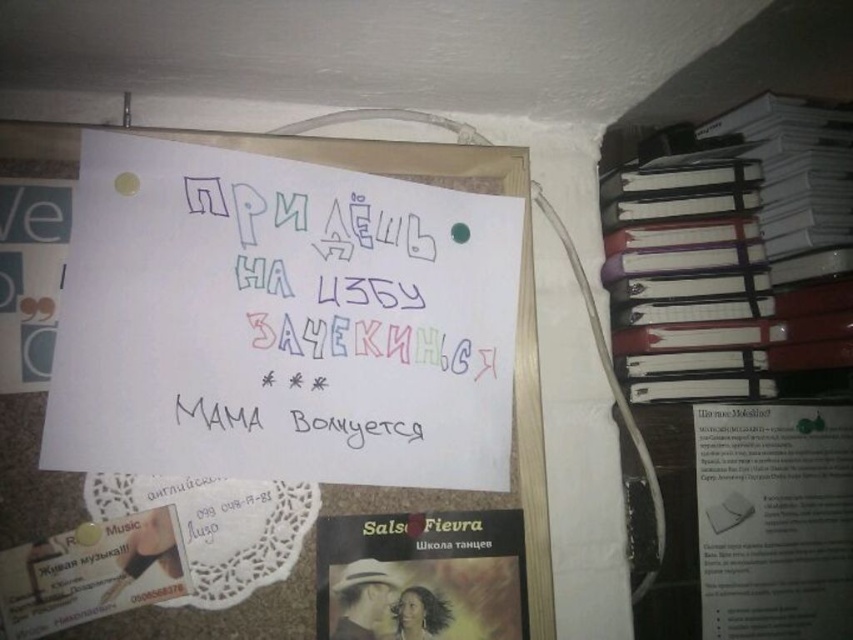
Question: Does white paper at right come in front of white paper at upper center?

Choices:
 (A) no
 (B) yes

Answer: (A)

Question: Is colored paper note at center to the right of white paper at right from the viewer's perspective?

Choices:
 (A) no
 (B) yes

Answer: (A)

Question: Does colored paper note at center appear on the right side of white paper at right?

Choices:
 (A) no
 (B) yes

Answer: (A)

Question: Based on their relative distances, which object is nearer to the matte black book at center?

Choices:
 (A) colored paper note at center
 (B) white paper at right
 (C) white paper at upper center

Answer: (C)

Question: Which point is closer to the camera?

Choices:
 (A) matte black book at center
 (B) white paper at right
 (C) colored paper note at center
 (D) white paper at upper center

Answer: (A)

Question: Which point is farther to the camera?

Choices:
 (A) 320,387
 (B) 753,99
 (C) 450,152

Answer: (B)